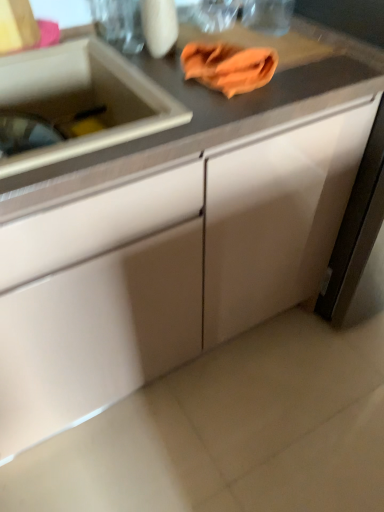
I want to click on vacant space situated on the left part of orange cloth at upper center, so click(148, 76).